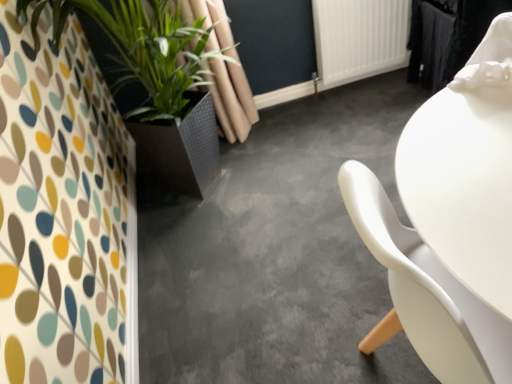
Question: Is concretesmoothfloor at center in front of green leafy plant at left?

Choices:
 (A) yes
 (B) no

Answer: (A)

Question: Does concretesmoothfloor at center have a smaller size compared to green leafy plant at left?

Choices:
 (A) yes
 (B) no

Answer: (A)

Question: Is concretesmoothfloor at center next to green leafy plant at left and touching it?

Choices:
 (A) no
 (B) yes

Answer: (A)

Question: From a real-world perspective, is concretesmoothfloor at center below green leafy plant at left?

Choices:
 (A) no
 (B) yes

Answer: (B)

Question: Can you confirm if concretesmoothfloor at center is bigger than green leafy plant at left?

Choices:
 (A) no
 (B) yes

Answer: (A)

Question: Looking at their shapes, would you say white plastic radiator at upper center is wider or thinner than concretesmoothfloor at center?

Choices:
 (A) wide
 (B) thin

Answer: (B)

Question: In the image, is white plastic radiator at upper center positioned in front of or behind concretesmoothfloor at center?

Choices:
 (A) front
 (B) behind

Answer: (B)

Question: Is point (399, 1) positioned closer to the camera than point (291, 240)?

Choices:
 (A) closer
 (B) farther

Answer: (B)

Question: Is white plastic radiator at upper center situated inside concretesmoothfloor at center or outside?

Choices:
 (A) inside
 (B) outside

Answer: (B)

Question: Considering the positions of point (170, 11) and point (243, 319), is point (170, 11) closer or farther from the camera than point (243, 319)?

Choices:
 (A) farther
 (B) closer

Answer: (A)

Question: Do you think green leafy plant at left is within concretesmoothfloor at center, or outside of it?

Choices:
 (A) inside
 (B) outside

Answer: (B)

Question: In terms of height, does green leafy plant at left look taller or shorter compared to concretesmoothfloor at center?

Choices:
 (A) short
 (B) tall

Answer: (B)

Question: In the image, is green leafy plant at left positioned in front of or behind concretesmoothfloor at center?

Choices:
 (A) front
 (B) behind

Answer: (B)

Question: Considering the positions of white plastic radiator at upper center and green leafy plant at left in the image, is white plastic radiator at upper center wider or thinner than green leafy plant at left?

Choices:
 (A) thin
 (B) wide

Answer: (A)

Question: From a real-world perspective, is white plastic radiator at upper center above or below green leafy plant at left?

Choices:
 (A) below
 (B) above

Answer: (A)